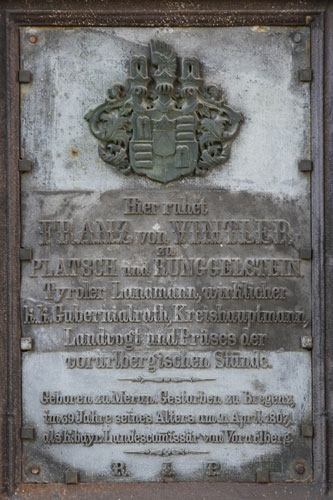
The image size is (333, 500). In order to click on ornament in this screenshot , I will do `click(165, 104)`.